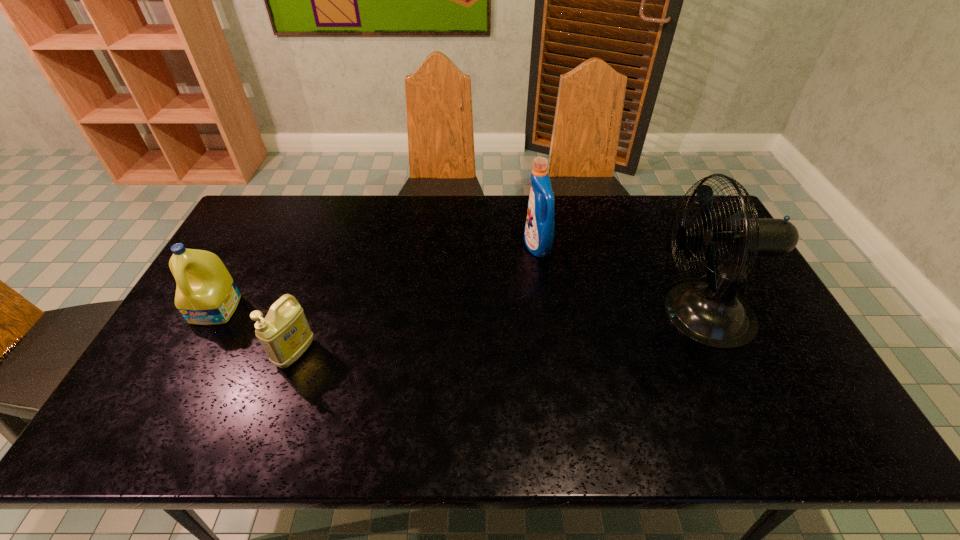
You are a GUI agent. You are given a task and a screenshot of the screen. Output one action in this format:
    pyautogui.click(x=<x>, y=<y>)
    Task: Click on the empty space between the fan and the farthest detergent
    
    Given the screenshot: What is the action you would take?
    pyautogui.click(x=619, y=280)

Where is `free area in between the farthest detergent and the shortest detergent`? The height and width of the screenshot is (540, 960). free area in between the farthest detergent and the shortest detergent is located at coordinates (417, 300).

The width and height of the screenshot is (960, 540). I want to click on free spot between the fan and the third shortest object, so click(619, 280).

Locate an element on the screen. the closest object to the second detergent from left to right is located at coordinates (206, 294).

Image resolution: width=960 pixels, height=540 pixels. What are the coordinates of `object that is the third nearest to the fan` in the screenshot? It's located at (206, 294).

Locate an element on the screen. Image resolution: width=960 pixels, height=540 pixels. detergent identified as the closest to the shortest object is located at coordinates (206, 294).

Image resolution: width=960 pixels, height=540 pixels. In order to click on the second closest detergent to the second object from right to left in this screenshot , I will do `click(206, 294)`.

Locate an element on the screen. blank area in the image that satisfies the following two spatial constraints: 1. on the label of the second nearest detergent; 2. on the left side of the nearest detergent is located at coordinates (193, 353).

Identify the location of free spot that satisfies the following two spatial constraints: 1. on the label of the nearest detergent; 2. on the left side of the second nearest detergent. Image resolution: width=960 pixels, height=540 pixels. (193, 353).

Where is `vacant region that satisfies the following two spatial constraints: 1. on the label of the rightmost detergent; 2. on the front side of the third object from right to left`? The image size is (960, 540). vacant region that satisfies the following two spatial constraints: 1. on the label of the rightmost detergent; 2. on the front side of the third object from right to left is located at coordinates (552, 353).